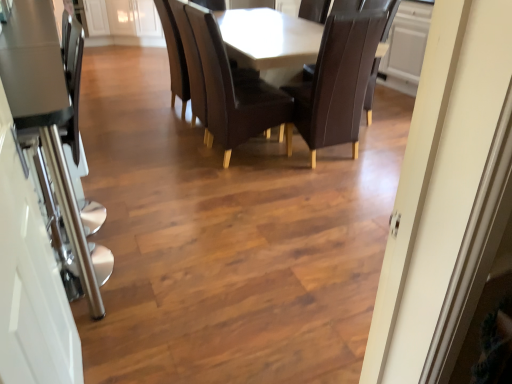
Where is `free spot in front of leather at center, the first chair positioned from the left`? This screenshot has height=384, width=512. free spot in front of leather at center, the first chair positioned from the left is located at coordinates (247, 190).